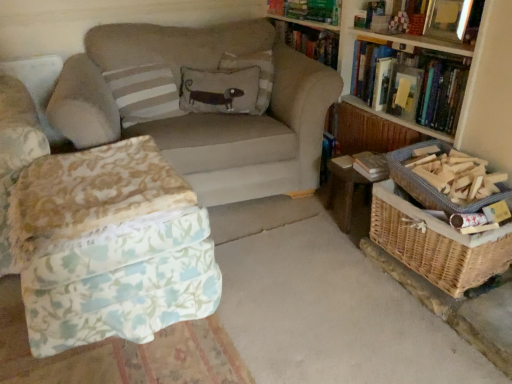
Identify the location of vacant space that is in between floral fabric ottoman at lower left and woven wood table at lower right. (268, 249).